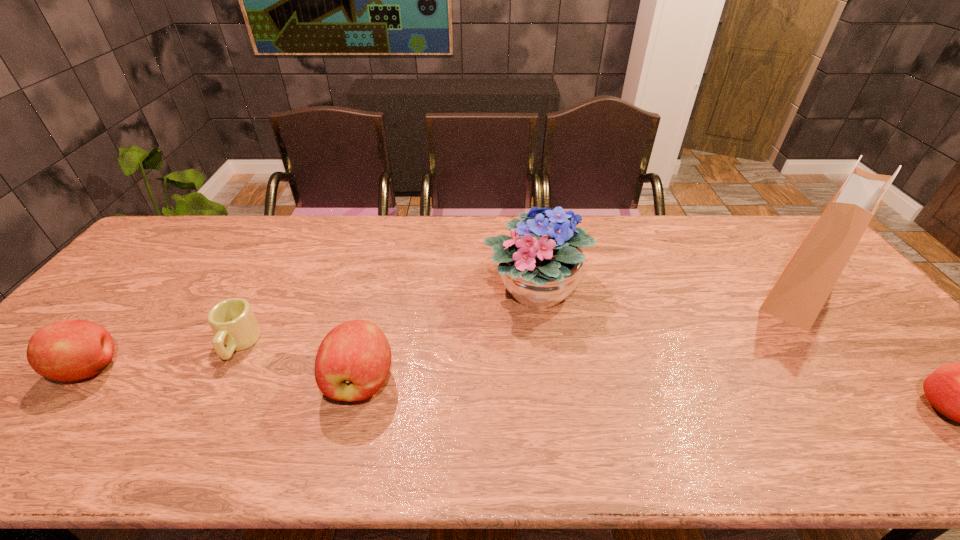
If we want them evenly spaced by inserting an extra apple among them, please locate a free spot for this new apple. Please provide its 2D coordinates. Your answer should be formatted as a tuple, i.e. [(x, y)], where the tuple contains the x and y coordinates of a point satisfying the conditions above.

[(644, 394)]